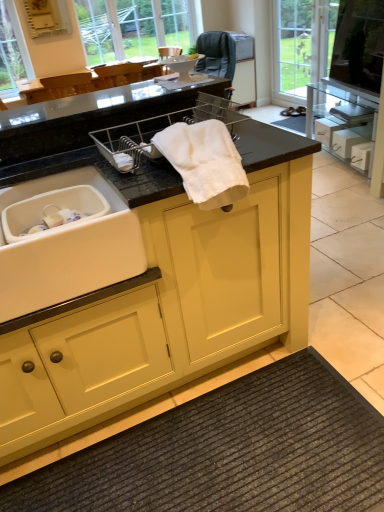
Question: Are matte yellow cabinet at center and clear glass window at upper center making contact?

Choices:
 (A) yes
 (B) no

Answer: (B)

Question: From a real-world perspective, is matte yellow cabinet at center physically above clear glass window at upper center?

Choices:
 (A) yes
 (B) no

Answer: (B)

Question: Could you tell me if matte yellow cabinet at center is turned towards clear glass window at upper center?

Choices:
 (A) yes
 (B) no

Answer: (B)

Question: Is matte yellow cabinet at center further to the viewer compared to clear glass window at upper center?

Choices:
 (A) no
 (B) yes

Answer: (A)

Question: Is matte yellow cabinet at center looking in the opposite direction of clear glass window at upper center?

Choices:
 (A) yes
 (B) no

Answer: (A)

Question: Would you say matte yellow cabinet at center is inside or outside white matte sink at lower left?

Choices:
 (A) outside
 (B) inside

Answer: (A)

Question: From the image's perspective, is matte yellow cabinet at center above or below white matte sink at lower left?

Choices:
 (A) below
 (B) above

Answer: (A)

Question: Based on their sizes in the image, would you say matte yellow cabinet at center is bigger or smaller than white matte sink at lower left?

Choices:
 (A) big
 (B) small

Answer: (A)

Question: Relative to white matte sink at lower left, is matte yellow cabinet at center in front or behind?

Choices:
 (A) front
 (B) behind

Answer: (A)

Question: From the image's perspective, is transparent glass tv at upper right above or below white cotton towel at center?

Choices:
 (A) below
 (B) above

Answer: (B)

Question: Considering the relative positions of transparent glass tv at upper right and white cotton towel at center in the image provided, is transparent glass tv at upper right to the left or to the right of white cotton towel at center?

Choices:
 (A) left
 (B) right

Answer: (B)

Question: Considering their positions, is transparent glass tv at upper right located in front of or behind white cotton towel at center?

Choices:
 (A) front
 (B) behind

Answer: (B)

Question: Based on their sizes in the image, would you say transparent glass tv at upper right is bigger or smaller than white cotton towel at center?

Choices:
 (A) big
 (B) small

Answer: (A)

Question: Visually, is clear glass window at upper center positioned to the left or to the right of white cotton towel at center?

Choices:
 (A) left
 (B) right

Answer: (A)

Question: From the image's perspective, relative to white cotton towel at center, is clear glass window at upper center above or below?

Choices:
 (A) below
 (B) above

Answer: (B)